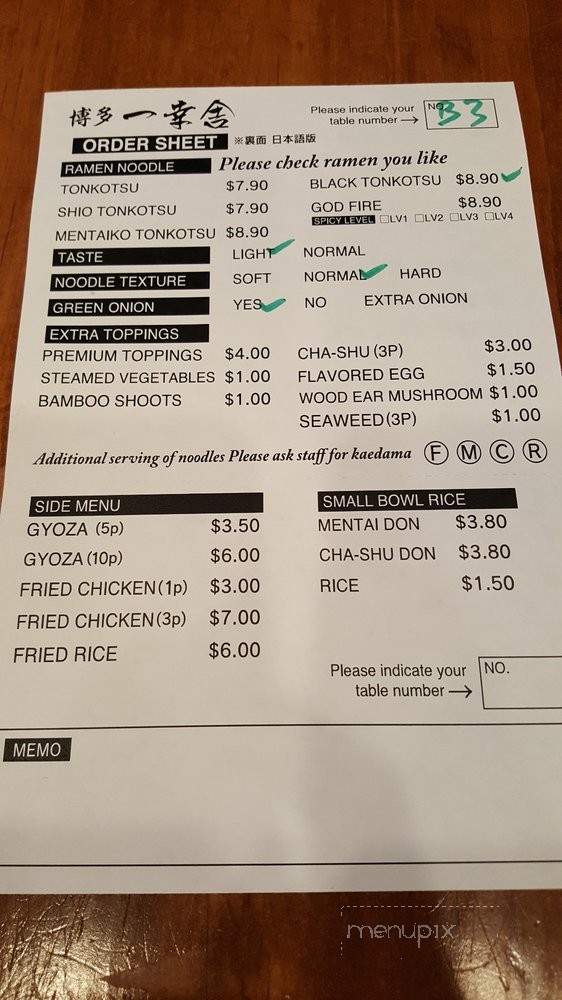
What are the coordinates of `table` in the screenshot? It's located at (282, 936).